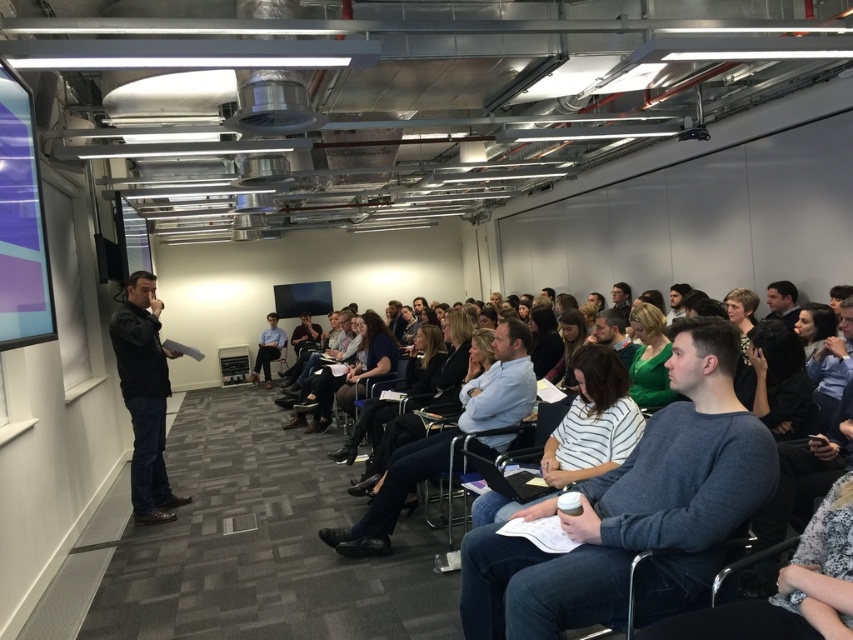
Question: Is light blue shirt at center below matte purple projection screen at left?

Choices:
 (A) no
 (B) yes

Answer: (B)

Question: Among these points, which one is nearest to the camera?

Choices:
 (A) (637, 316)
 (B) (16, 118)
 (C) (566, 348)
 (D) (599, 346)

Answer: (B)

Question: Is white striped shirt at center closer to camera compared to dark brown hair at center?

Choices:
 (A) yes
 (B) no

Answer: (A)

Question: Which point is farther to the camera?

Choices:
 (A) black leather jacket at left
 (B) blue shirt at center
 (C) light blue shirt at center
 (D) green matte shirt at center

Answer: (B)

Question: Is blue sweater at center to the right of black fabric at center from the viewer's perspective?

Choices:
 (A) no
 (B) yes

Answer: (A)

Question: Which point is closer to the camera?

Choices:
 (A) (653, 380)
 (B) (785, 387)
 (C) (569, 337)
 (D) (608, 360)

Answer: (D)